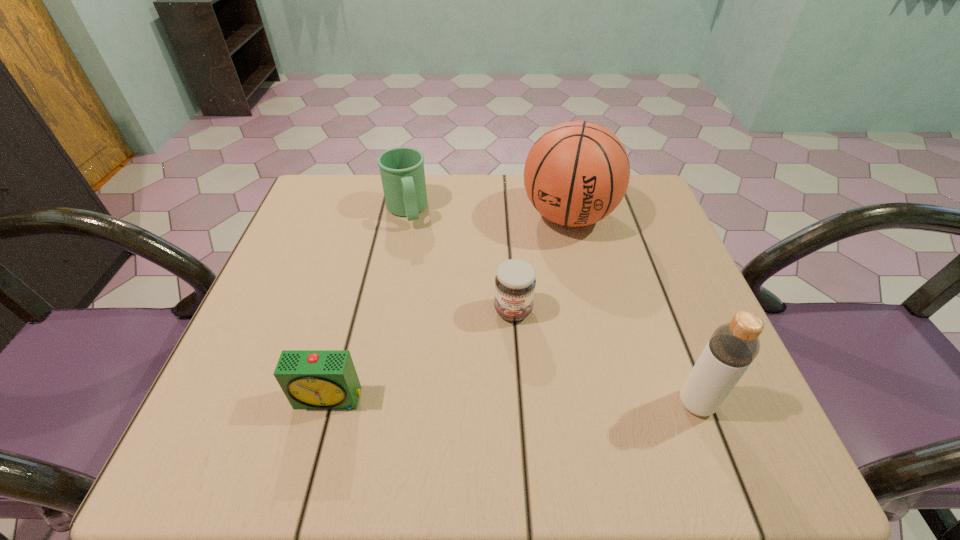
Identify the location of alarm clock. (311, 379).

The height and width of the screenshot is (540, 960). I want to click on bottle, so click(733, 346).

The image size is (960, 540). Identify the location of basketball. (577, 173).

The height and width of the screenshot is (540, 960). I want to click on the third nearest object, so pos(515,281).

Image resolution: width=960 pixels, height=540 pixels. I want to click on mug, so click(x=402, y=172).

Image resolution: width=960 pixels, height=540 pixels. I want to click on free location located on the left of the bottle, so click(596, 403).

Locate an element on the screen. This screenshot has width=960, height=540. free space located 0.050m on the surface of the basketball near the brand logo is located at coordinates (559, 260).

Where is `free spot located 0.050m on the surface of the basketball near the brand logo`? This screenshot has height=540, width=960. free spot located 0.050m on the surface of the basketball near the brand logo is located at coordinates (559, 260).

This screenshot has height=540, width=960. In order to click on free location located 0.060m on the surface of the basketball near the brand logo in this screenshot , I will do `click(558, 264)`.

Find the location of a particular element. This screenshot has width=960, height=540. vacant space located 0.100m on the front label of the third farthest object is located at coordinates (511, 369).